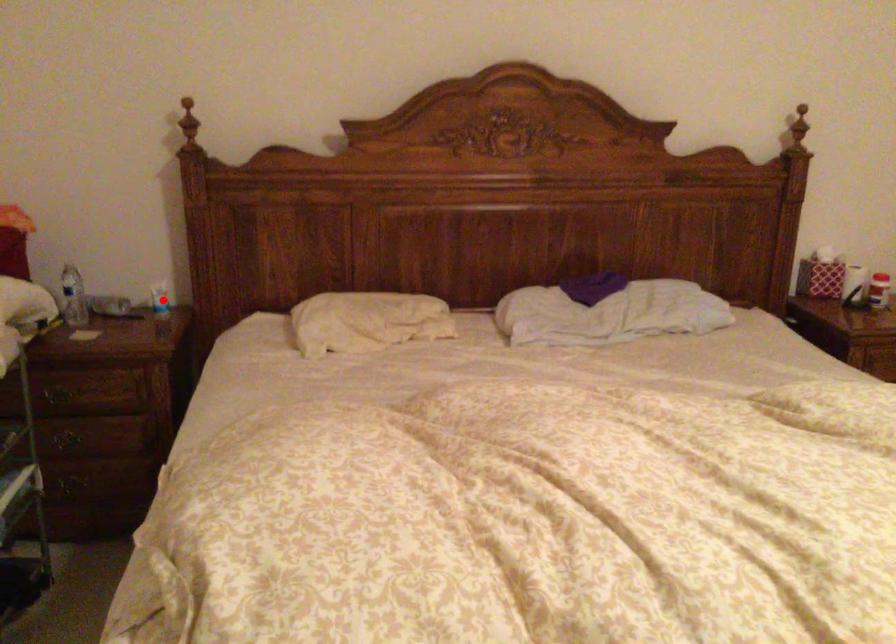
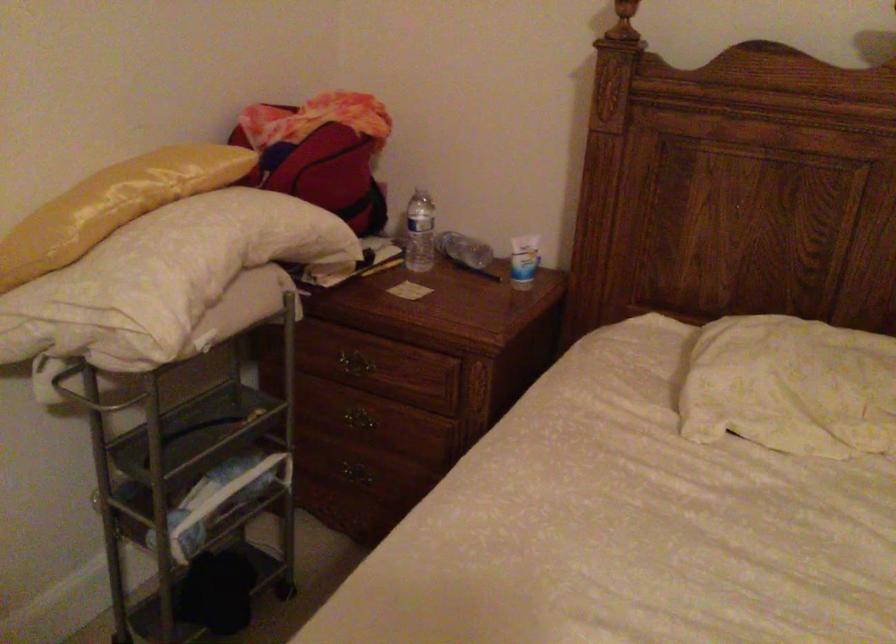
Question: I am providing you with two images of the same scene from different viewpoints. A red point is shown in image1. For the corresponding object point in image2, is it positioned nearer or farther from the camera?

Choices:
 (A) Nearer
 (B) Farther

Answer: (A)